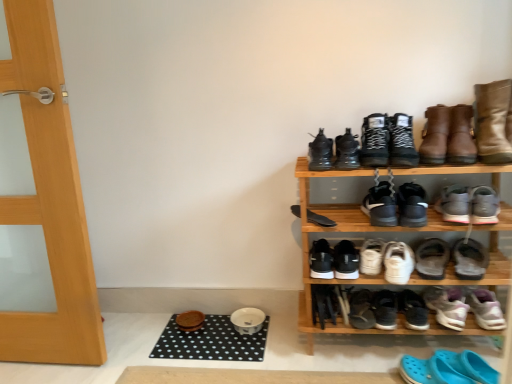
This screenshot has width=512, height=384. Identify the location of vacant area that lies between wooden shoe rack at upper right and black dotted mat at lower center, the first doormat in the back-to-front sequence. (286, 336).